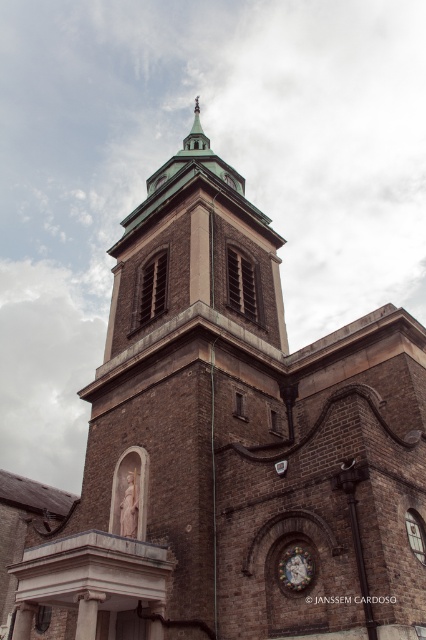
Question: Does matte gold clock at center lie in front of green metallic spire at upper center?

Choices:
 (A) no
 (B) yes

Answer: (B)

Question: Is matte gold clock at center thinner than green metallic spire at upper center?

Choices:
 (A) yes
 (B) no

Answer: (A)

Question: Among these points, which one is farthest from the camera?

Choices:
 (A) (284, 577)
 (B) (207, 154)

Answer: (B)

Question: Which point is farther to the camera?

Choices:
 (A) matte gold clock at center
 (B) green metallic spire at upper center

Answer: (B)

Question: Among these objects, which one is nearest to the camera?

Choices:
 (A) green metallic spire at upper center
 (B) matte gold clock at center

Answer: (B)

Question: Is matte gold clock at center to the left of green metallic spire at upper center from the viewer's perspective?

Choices:
 (A) yes
 (B) no

Answer: (B)